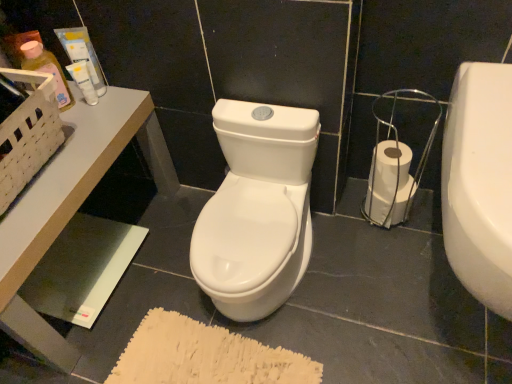
This screenshot has height=384, width=512. What are the coordinates of `free space in front of matte plastic tube at upper left, which ranks as the second toiletry in left-to-right order` in the screenshot? It's located at (87, 133).